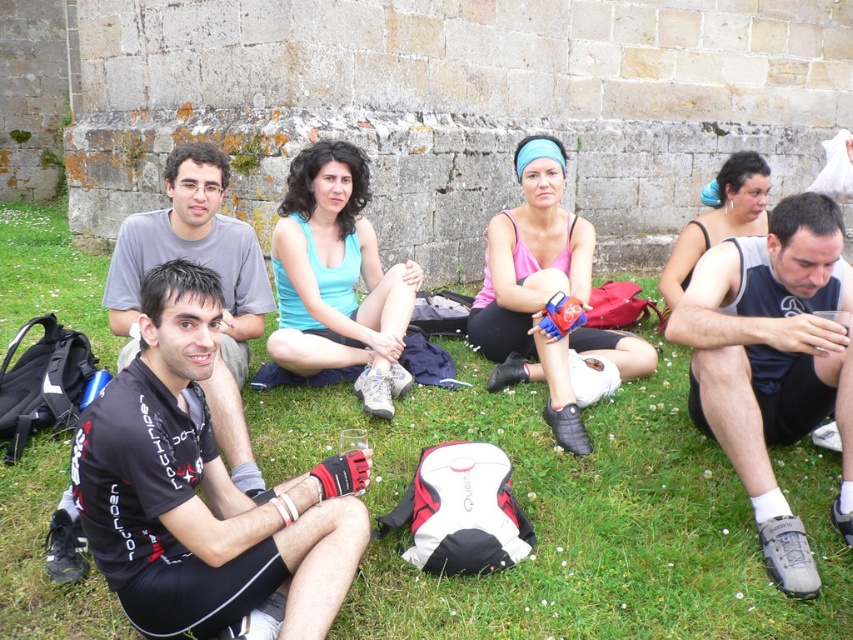
Question: Estimate the real-world distances between objects in this image. Which object is farther from the pink matte tank top at center?

Choices:
 (A) black matte shirt at center
 (B) gray matte shirt at left

Answer: (B)

Question: Which of the following is the closest to the observer?

Choices:
 (A) (236, 275)
 (B) (180, 196)
 (C) (67, 321)
 (D) (502, 371)

Answer: (B)

Question: Among these objects, which one is nearest to the camera?

Choices:
 (A) gray matte shirt at left
 (B) pink matte tank top at center

Answer: (A)

Question: Does green grass at lower center have a greater width compared to black jersey at center?

Choices:
 (A) no
 (B) yes

Answer: (B)

Question: In this image, where is black jersey at center located relative to dark blue fabric tank top at center right?

Choices:
 (A) below
 (B) above

Answer: (A)

Question: Can you confirm if green grass at lower center is positioned below light blue tank top at center?

Choices:
 (A) yes
 (B) no

Answer: (A)